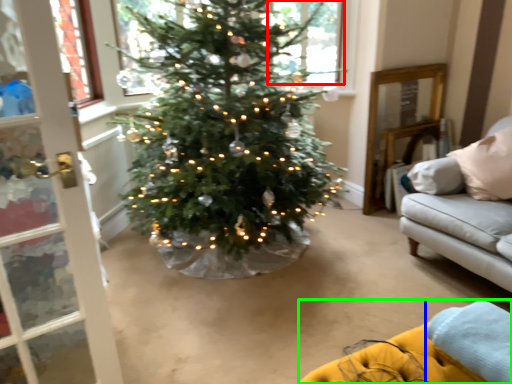
Question: Which object is positioned farthest from window (highlighted by a red box)? Select from blanket (highlighted by a blue box) and couch (highlighted by a green box).

Choices:
 (A) blanket
 (B) couch

Answer: (B)